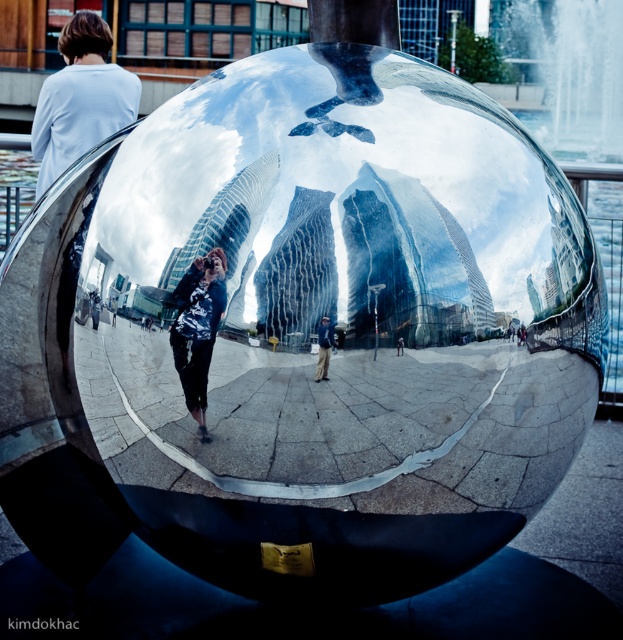
Question: Which object appears closest to the camera in this image?

Choices:
 (A) matte black jacket at center
 (B) light brown leather jacket at center

Answer: (B)

Question: Is matte black jacket at center wider than light brown leather jacket at center?

Choices:
 (A) no
 (B) yes

Answer: (B)

Question: Can you confirm if matte black jacket at center is smaller than light brown leather jacket at center?

Choices:
 (A) yes
 (B) no

Answer: (B)

Question: Which of the following is the farthest from the observer?

Choices:
 (A) matte black jacket at center
 (B) light brown leather jacket at center

Answer: (A)

Question: Can you confirm if matte black jacket at center is wider than light brown leather jacket at center?

Choices:
 (A) yes
 (B) no

Answer: (A)

Question: Which object is closer to the camera taking this photo?

Choices:
 (A) light brown leather jacket at center
 (B) matte black jacket at center

Answer: (A)